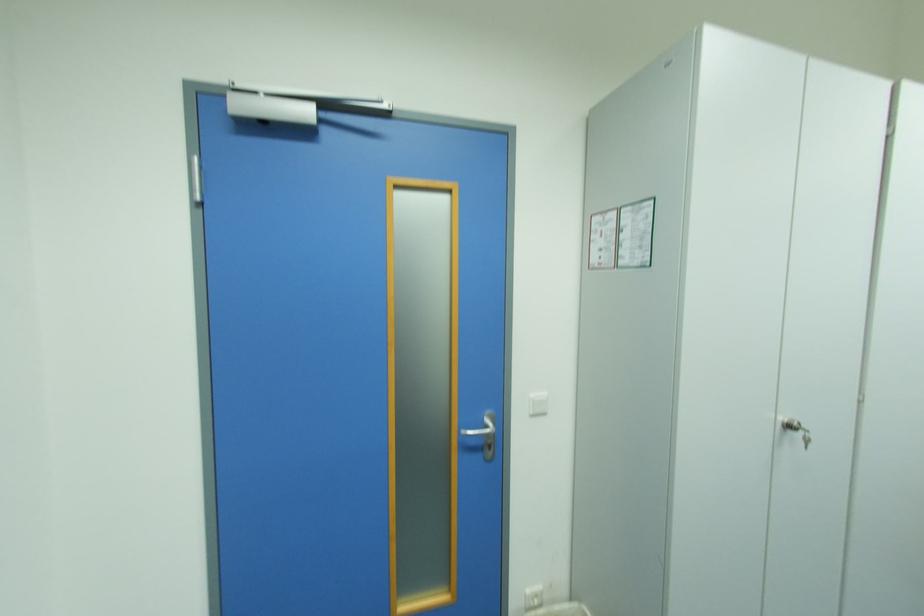
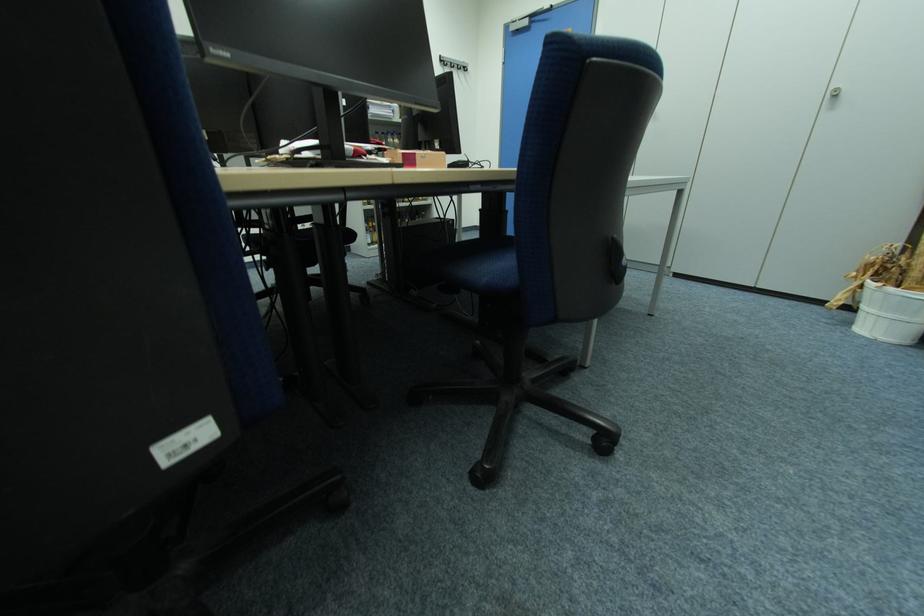
Question: I am providing you with two images of the same scene from different viewpoints. Which of the following objects are not visible in image2?

Choices:
 (A) silver door handle
 (B) blue door handle
 (C) white bucket
 (D) blue nivea tube

Answer: (A)